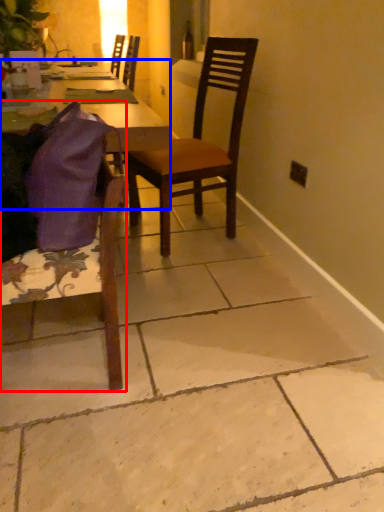
Question: Which of the following is the closest to the observer, chair (highlighted by a red box) or desk (highlighted by a blue box)?

Choices:
 (A) chair
 (B) desk

Answer: (A)